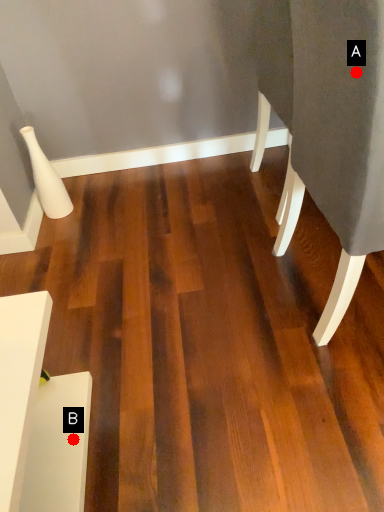
Question: Two points are circled on the image, labeled by A and B beside each circle. Which point is closer to the camera?

Choices:
 (A) A is closer
 (B) B is closer

Answer: (A)